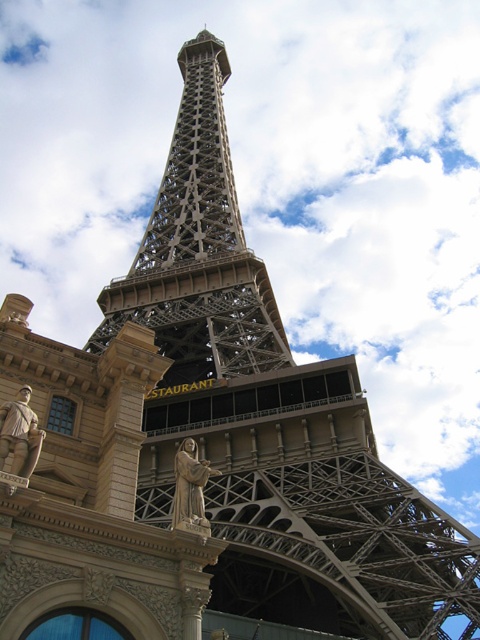
You are standing in front of the Eiffel Tower replica and notice two points marked on the structure. The first point is at coordinate point (x=19, y=435) and the second is at point (x=201, y=472). If you want to touch the closest point to you on the Eiffel Tower replica, which coordinate should you aim for?

The point at coordinate point (x=19, y=435) is closer to the viewer than point (x=201, y=472), so you should aim for point (x=19, y=435).

You are standing in front of the replica Eiffel Tower and need to determine its exact position relative to the surrounding structures. According to the coordinates provided, where is the metallic gray eiffel tower at center positioned?

The metallic gray eiffel tower at center is located at point coordinates [199,248].

You are standing in front of the Eiffel Tower replica. If you look at the point marked at coordinates (199, 248), what object would you see there?

The point at coordinates (199, 248) corresponds to the metallic gray Eiffel Tower at center, so you would see the metallic gray Eiffel Tower at center there.